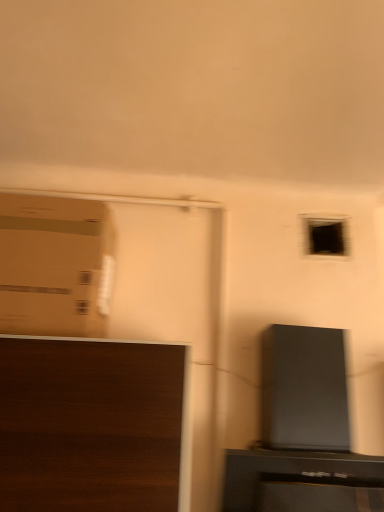
Question: In the image, is dark wood cabinet at lower left positioned in front of or behind cardboard box at left?

Choices:
 (A) behind
 (B) front

Answer: (B)

Question: Based on their positions, is dark wood cabinet at lower left located to the left or right of cardboard box at left?

Choices:
 (A) left
 (B) right

Answer: (B)

Question: From the image's perspective, relative to cardboard box at left, is dark wood cabinet at lower left above or below?

Choices:
 (A) above
 (B) below

Answer: (B)

Question: From the image's perspective, is cardboard box at left located above or below dark wood cabinet at lower left?

Choices:
 (A) below
 (B) above

Answer: (B)

Question: Is cardboard box at left in front of or behind dark wood cabinet at lower left in the image?

Choices:
 (A) front
 (B) behind

Answer: (B)

Question: From a real-world perspective, relative to dark wood cabinet at lower left, is cardboard box at left vertically above or below?

Choices:
 (A) below
 (B) above

Answer: (B)

Question: Considering the positions of point (59, 266) and point (105, 428), is point (59, 266) closer or farther from the camera than point (105, 428)?

Choices:
 (A) farther
 (B) closer

Answer: (A)